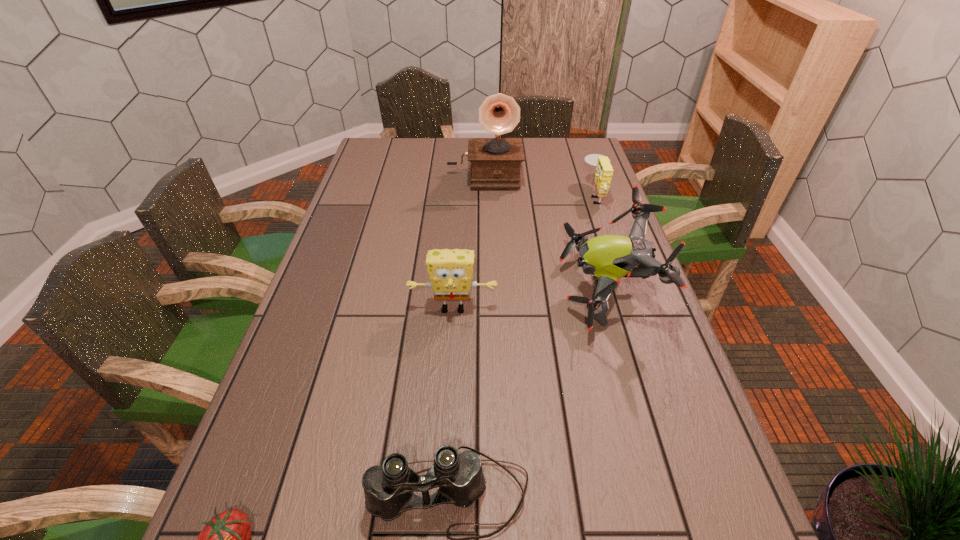
The height and width of the screenshot is (540, 960). I want to click on the tallest object, so click(x=495, y=162).

The width and height of the screenshot is (960, 540). I want to click on drone, so click(609, 258).

Image resolution: width=960 pixels, height=540 pixels. Identify the location of the left sponge. (450, 272).

Where is `the taller sponge`? The width and height of the screenshot is (960, 540). the taller sponge is located at coordinates (450, 272).

Image resolution: width=960 pixels, height=540 pixels. Identify the location of the farther sponge. (604, 172).

The image size is (960, 540). Identify the location of the shorter sponge. (604, 172).

The width and height of the screenshot is (960, 540). Find the location of `free spot located on the horn of the tallest object`. free spot located on the horn of the tallest object is located at coordinates (485, 201).

Locate an element on the screen. vacant space located 0.060m on the front-facing side of the fifth shortest object is located at coordinates (540, 289).

Find the location of a particular element. This screenshot has height=540, width=960. free space located 0.330m on the front-facing side of the fifth shortest object is located at coordinates point(441,289).

You are a GUI agent. You are given a task and a screenshot of the screen. Output one action in this format:
    pyautogui.click(x=<x>, y=<y>)
    Task: Click on the blank area located 0.190m on the front-facing side of the fifth shortest object
    This screenshot has width=960, height=540.
    Given the screenshot: What is the action you would take?
    pyautogui.click(x=492, y=289)